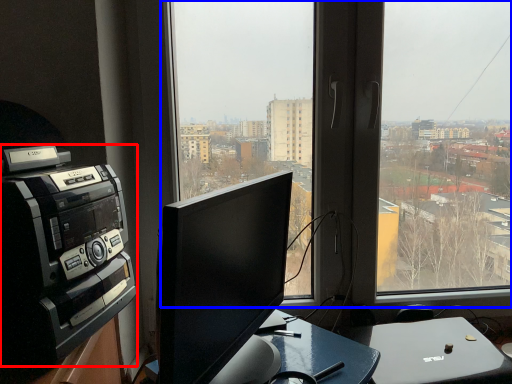
Question: Which object appears farthest to the camera in this image, amplifier (highlighted by a red box) or window (highlighted by a blue box)?

Choices:
 (A) amplifier
 (B) window

Answer: (B)